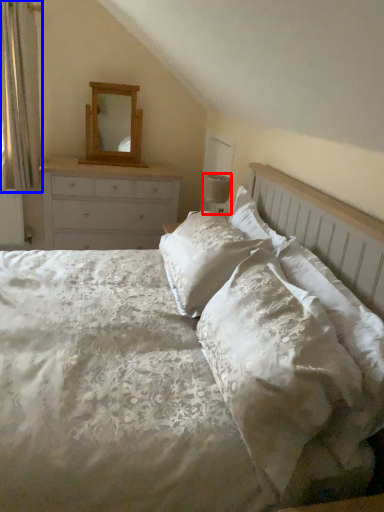
Question: Which object is further to the camera taking this photo, lamp (highlighted by a red box) or curtain (highlighted by a blue box)?

Choices:
 (A) lamp
 (B) curtain

Answer: (B)